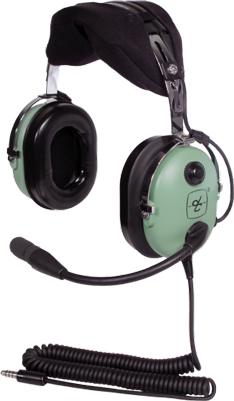
What are the coordinates of `right speaker` in the screenshot? It's located at (69, 164).